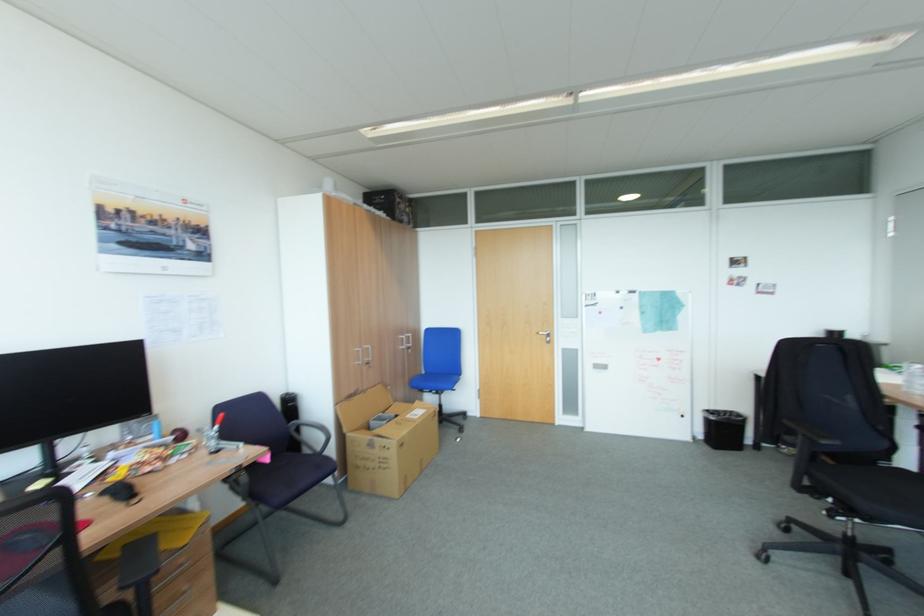
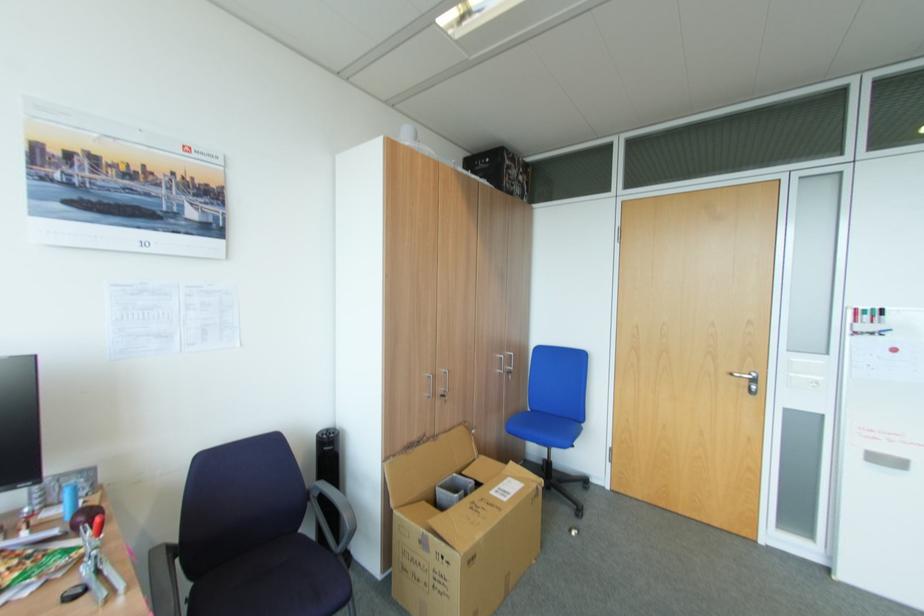
In the second image, find the point that corresponds to point (407, 445) in the first image.

(479, 556)